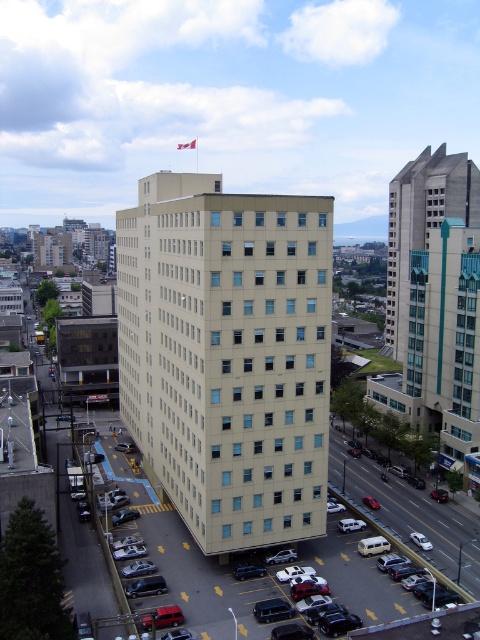
You are standing at the center of the image. Which direction should you walk to reach the black asphalt parking lot at lower center?

You should walk downward because the black asphalt parking lot at lower center is located at point [411,513], which is below the center of the image.

You are a drone operator tasked with capturing aerial footage of the city. Your drone has a maximum flight range of 80 meters. You need to fly from your current position to the black asphalt parking lot at lower center to capture a close shot. Can your drone reach the parking lot without exceeding its range limit?

The black asphalt parking lot at lower center is 75.81 meters from camera, so yes, the drone can reach it since the distance is within the 80 meters range limit.

You are a city planner assessing the space in front of the beige building. The black asphalt parking lot at lower center and the red fabric flag at upper center are both visible from your vantage point. Which object occupies a larger horizontal space in the image?

The black asphalt parking lot at lower center might be wider than red fabric flag at upper center, so it likely occupies a larger horizontal space in the image.